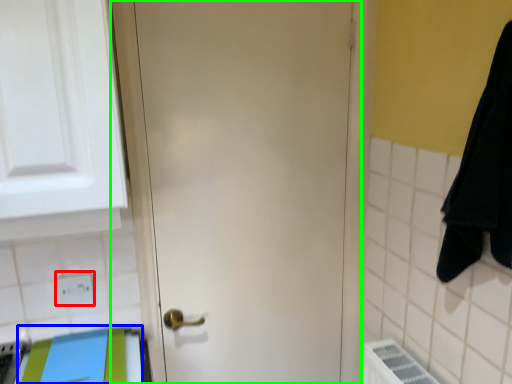
Question: Which object is the closest to the electric outlet (highlighted by a red box)? Choose among these: beach towel (highlighted by a blue box) or door (highlighted by a green box).

Choices:
 (A) beach towel
 (B) door

Answer: (A)